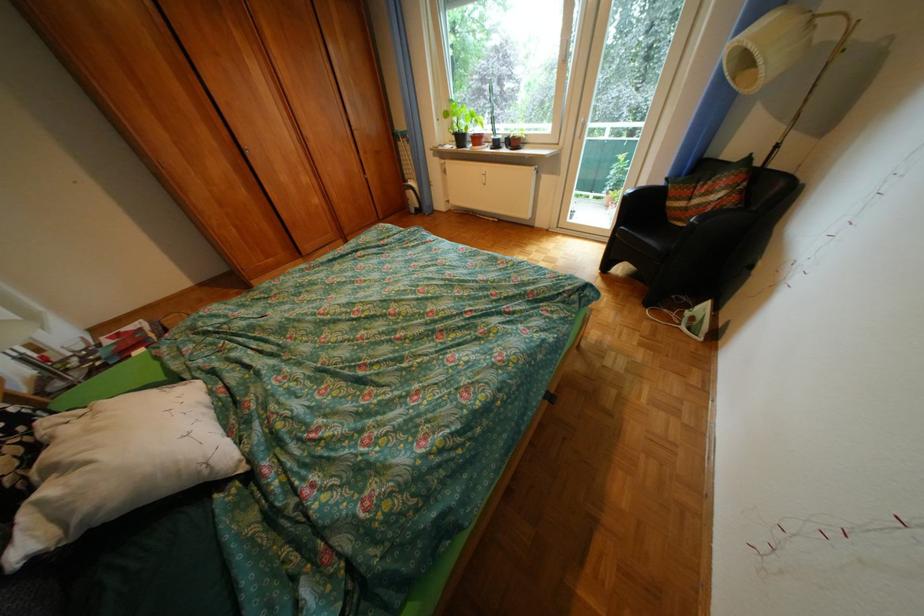
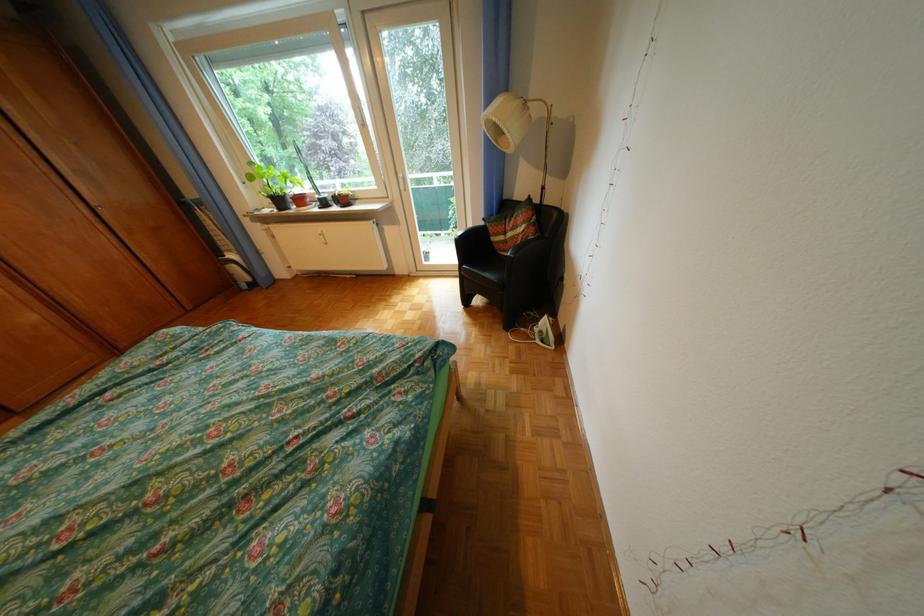
The point at (687, 315) is marked in the first image. Where is the corresponding point in the second image?

(542, 331)